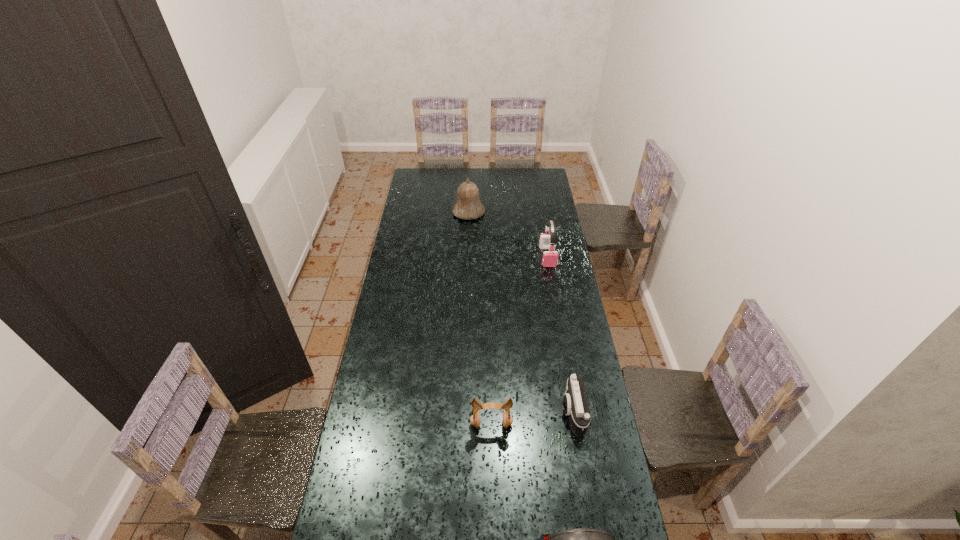
Where is `free space between the shortest object and the bell`? The width and height of the screenshot is (960, 540). free space between the shortest object and the bell is located at coordinates (520, 312).

This screenshot has height=540, width=960. Find the location of `vacant space in between the farthest object and the camera`. vacant space in between the farthest object and the camera is located at coordinates (520, 312).

Where is `unoccupied area between the farthest object and the camera`? This screenshot has height=540, width=960. unoccupied area between the farthest object and the camera is located at coordinates click(520, 312).

At what (x,y) coordinates should I click in order to perform the action: click on free spot between the second farthest object and the second farthest earphone. Please return your answer as a coordinate pair (x, y). The width and height of the screenshot is (960, 540). Looking at the image, I should click on (519, 341).

Identify the location of empty location between the shortest object and the second farthest earphone. (532, 418).

Select which object appears as the third closest to the bell. Please provide its 2D coordinates. Your answer should be formatted as a tuple, i.e. [(x, y)], where the tuple contains the x and y coordinates of a point satisfying the conditions above.

[(475, 418)]

Choose which object is the fourth nearest neighbor to the bell. Please provide its 2D coordinates. Your answer should be formatted as a tuple, i.e. [(x, y)], where the tuple contains the x and y coordinates of a point satisfying the conditions above.

[(584, 539)]

Identify which earphone is located as the third nearest to the farthest object. Please provide its 2D coordinates. Your answer should be formatted as a tuple, i.e. [(x, y)], where the tuple contains the x and y coordinates of a point satisfying the conditions above.

[(584, 539)]

Identify the location of earphone that is the third closest one to the farthest object. click(x=584, y=539).

Identify the location of free space that satisfies the following two spatial constraints: 1. on the front lens of the shortest object; 2. on the front-facing side of the leftmost earphone. This screenshot has width=960, height=540. (574, 424).